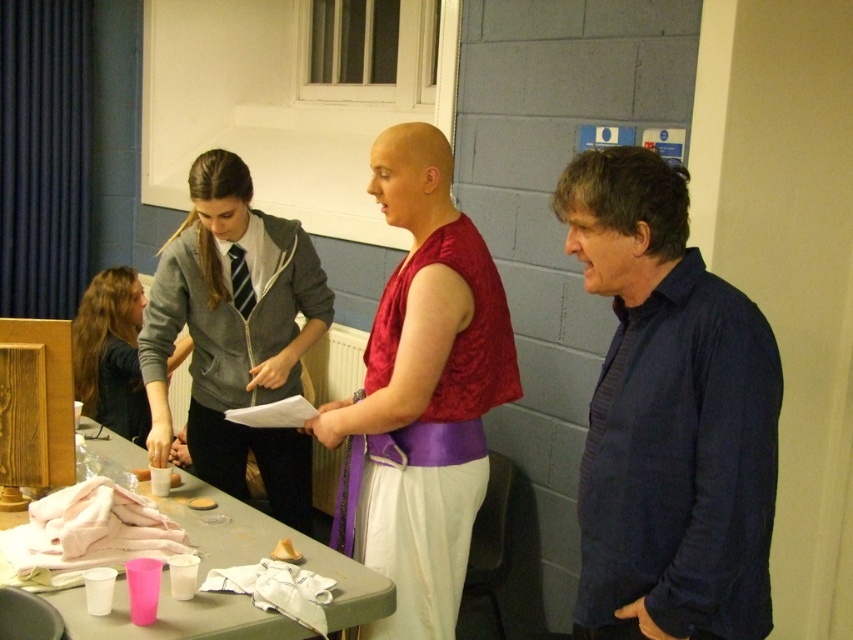
Question: Which point is farther from the camera taking this photo?

Choices:
 (A) (115, 348)
 (B) (316, 262)
 (C) (386, 186)
 (D) (241, 532)

Answer: (A)

Question: Which object is closer to the camera taking this photo?

Choices:
 (A) pink plastic cups at lower left
 (B) blue striped shirt at right
 (C) matte gray hoodie at center
 (D) shiny red fabric top at center

Answer: (B)

Question: From the image, what is the correct spatial relationship of shiny red fabric top at center in relation to gray fleece jacket at center?

Choices:
 (A) below
 (B) above

Answer: (A)

Question: Is blue striped shirt at right positioned at the back of pink plastic cups at lower left?

Choices:
 (A) yes
 (B) no

Answer: (B)

Question: Can you confirm if pink plastic cups at lower left is positioned below matte gray hoodie at center?

Choices:
 (A) yes
 (B) no

Answer: (A)

Question: Which point appears closest to the camera in this image?

Choices:
 (A) (776, 394)
 (B) (105, 348)
 (C) (225, 504)

Answer: (A)